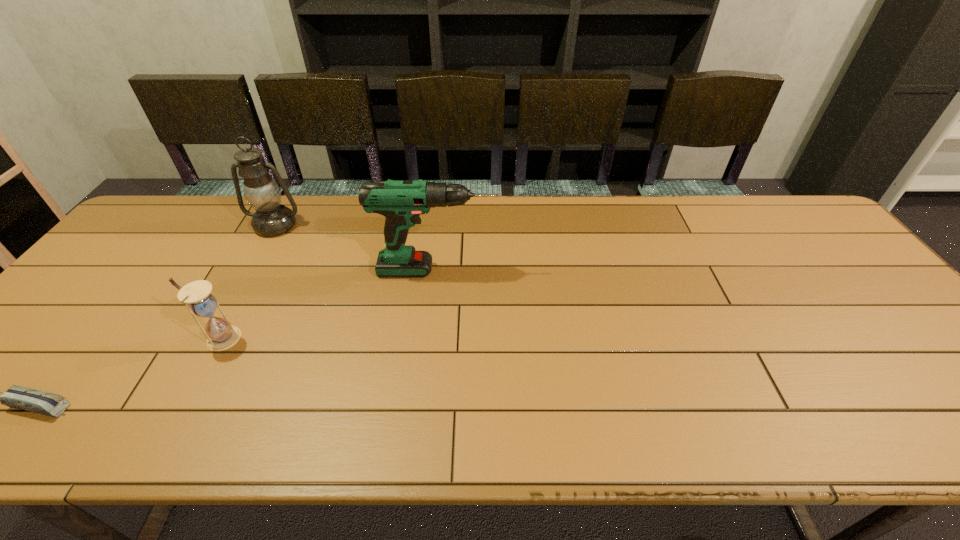
Image resolution: width=960 pixels, height=540 pixels. In order to click on oil lamp in this screenshot , I will do `click(262, 192)`.

Identify the location of the second farthest object. The width and height of the screenshot is (960, 540). 402,202.

The image size is (960, 540). I want to click on the rightmost object, so click(x=402, y=202).

This screenshot has height=540, width=960. I want to click on hourglass, so click(197, 296).

At what (x,y) coordinates should I click in order to perform the action: click on the third tallest object. Please return your answer as a coordinate pair (x, y). Looking at the image, I should click on (197, 296).

Identify the location of vacant space located 0.300m on the left of the farthest object. The width and height of the screenshot is (960, 540). (153, 225).

Locate an element on the screen. free space located on the handle side of the second farthest object is located at coordinates (621, 271).

Where is `vacant position located 0.170m on the left of the third tallest object`? Image resolution: width=960 pixels, height=540 pixels. vacant position located 0.170m on the left of the third tallest object is located at coordinates (132, 338).

Image resolution: width=960 pixels, height=540 pixels. I want to click on object that is positioned at the far edge, so click(x=262, y=192).

This screenshot has width=960, height=540. In the image, there is a desktop. Find the location of `vacant area at the far edge`. vacant area at the far edge is located at coordinates (696, 226).